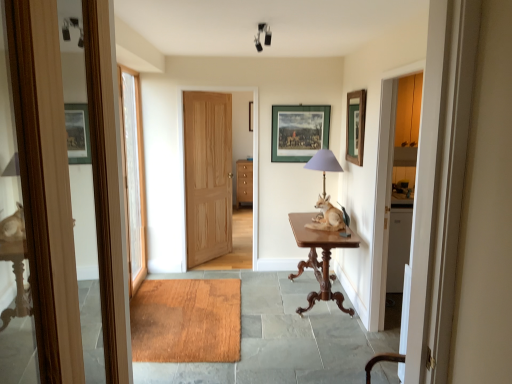
Question: From a real-world perspective, is wooden mat at center positioned above or below mahogany wood table at center?

Choices:
 (A) above
 (B) below

Answer: (B)

Question: Considering the positions of wooden mat at center and mahogany wood table at center in the image, is wooden mat at center wider or thinner than mahogany wood table at center?

Choices:
 (A) wide
 (B) thin

Answer: (A)

Question: Based on their relative distances, which object is farther from the matte purple glass table lamp at center?

Choices:
 (A) green matte picture frame at upper right, the 2th picture frame when ordered from left to right
 (B) mahogany wood table at center
 (C) wooden mat at center
 (D) green matte picture frame at center, which is the second picture frame in front-to-back order
 (E) white glass door at left, the 2th door positioned from the right

Answer: (E)

Question: Estimate the real-world distances between objects in this image. Which object is farther from the brown wooden table at center?

Choices:
 (A) wooden mat at center
 (B) mahogany wood table at center
 (C) green matte picture frame at upper right, which ranks as the 1th picture frame in front-to-back order
 (D) matte purple glass table lamp at center
 (E) green matte picture frame at center, which is counted as the second picture frame, starting from the right

Answer: (A)